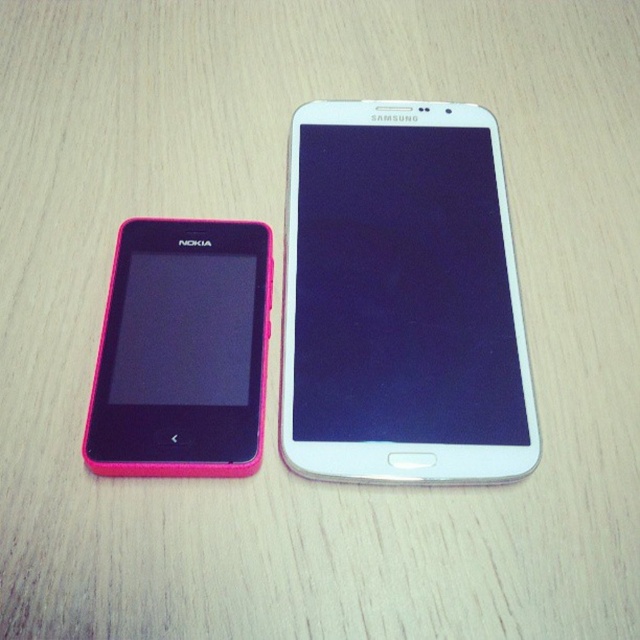
Does point (358, 381) come behind point (100, 388)?

Yes, it is behind point (100, 388).

Identify the location of white glossy smartphone at center. click(x=401, y=300).